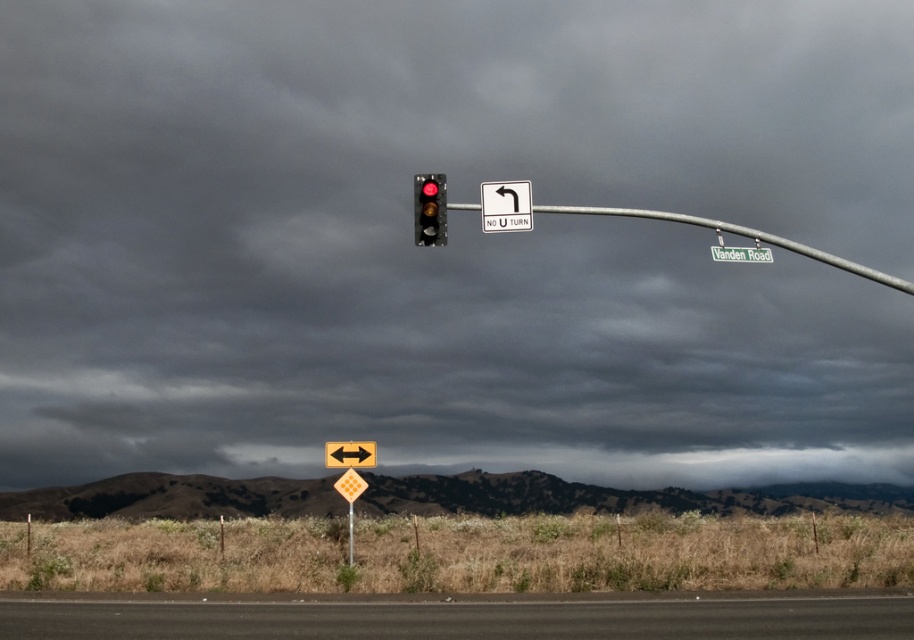
You are a pedestrian standing at the intersection and looking towards the traffic signal. There are two points marked in the scene. The first point is at coordinates point (339,449) and the second is at point (734,253). Which point is closer to you?

Point (734,253) is closer to you because it is in front of point (339,449) according to their spatial arrangement.

You are a driver approaching an intersection with a stormy sky. You see a white plastic sign at upper center and a yellow diamond at center. Which sign should you look at first based on their positions?

The white plastic sign at upper center is above the yellow diamond at center, so you should look at the white plastic sign at upper center first because it is positioned higher up.

You are driving a car and see the white plastic sign at upper center and the yellow diamond at center ahead on the road. Which sign will you encounter first as you approach them?

The white plastic sign at upper center is in front of the yellow diamond at center, so you will encounter the white plastic sign at upper center first as you approach them.